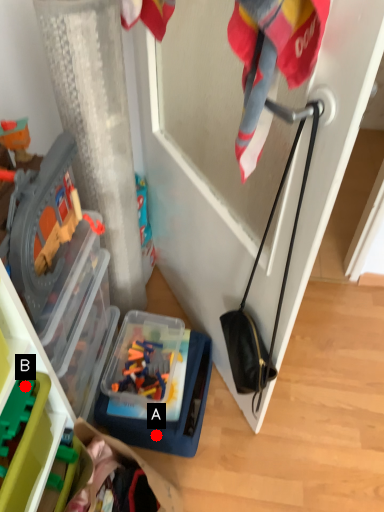
Question: Two points are circled on the image, labeled by A and B beside each circle. Which point is farther from the camera taking this photo?

Choices:
 (A) A is further
 (B) B is further

Answer: (A)